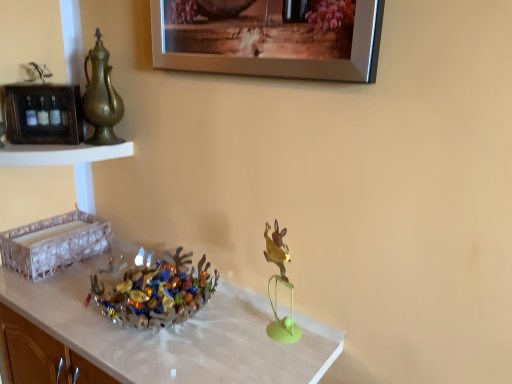
Question: Could you tell me if metallic gold rabbit at center is turned towards silver metallic picture frame at upper center?

Choices:
 (A) no
 (B) yes

Answer: (A)

Question: From the image's perspective, is metallic gold rabbit at center above silver metallic picture frame at upper center?

Choices:
 (A) yes
 (B) no

Answer: (B)

Question: From a real-world perspective, is metallic gold rabbit at center physically above silver metallic picture frame at upper center?

Choices:
 (A) yes
 (B) no

Answer: (B)

Question: Would you say metallic gold rabbit at center is a long distance from silver metallic picture frame at upper center?

Choices:
 (A) no
 (B) yes

Answer: (A)

Question: Does metallic gold rabbit at center have a greater height compared to silver metallic picture frame at upper center?

Choices:
 (A) yes
 (B) no

Answer: (A)

Question: Does metallic gold rabbit at center have a lesser width compared to silver metallic picture frame at upper center?

Choices:
 (A) no
 (B) yes

Answer: (A)

Question: Does translucent glass bowl at center come behind silver metallic picture frame at upper center?

Choices:
 (A) yes
 (B) no

Answer: (A)

Question: Can you confirm if translucent glass bowl at center is shorter than silver metallic picture frame at upper center?

Choices:
 (A) no
 (B) yes

Answer: (B)

Question: Is translucent glass bowl at center outside silver metallic picture frame at upper center?

Choices:
 (A) yes
 (B) no

Answer: (A)

Question: Considering the relative sizes of translucent glass bowl at center and silver metallic picture frame at upper center in the image provided, is translucent glass bowl at center wider than silver metallic picture frame at upper center?

Choices:
 (A) yes
 (B) no

Answer: (A)

Question: Can you confirm if translucent glass bowl at center is taller than silver metallic picture frame at upper center?

Choices:
 (A) no
 (B) yes

Answer: (A)

Question: Does translucent glass bowl at center have a larger size compared to silver metallic picture frame at upper center?

Choices:
 (A) no
 (B) yes

Answer: (B)

Question: Does gold metallic teapot at left have a larger size compared to translucent glass tray at left, which is the 2th shelf from top to bottom?

Choices:
 (A) no
 (B) yes

Answer: (A)